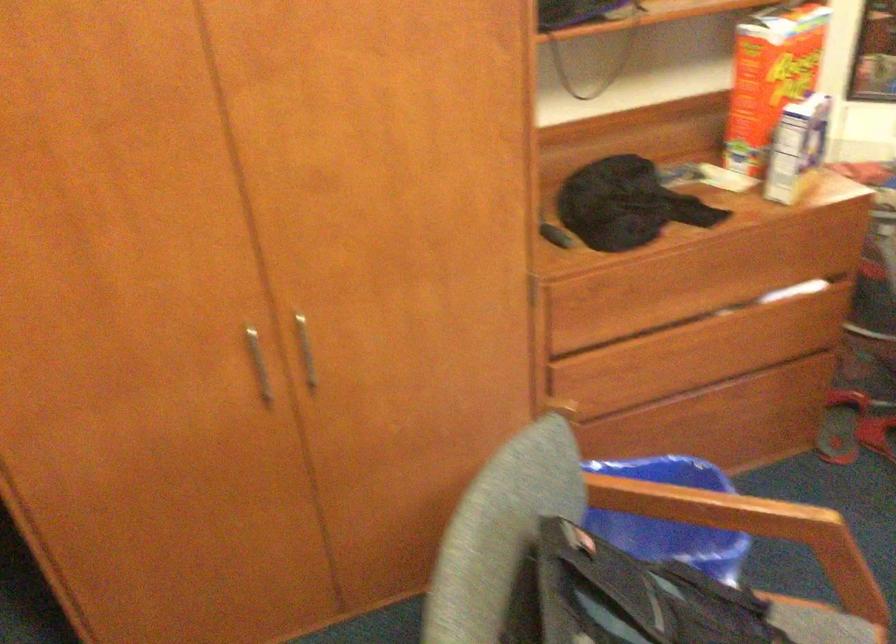
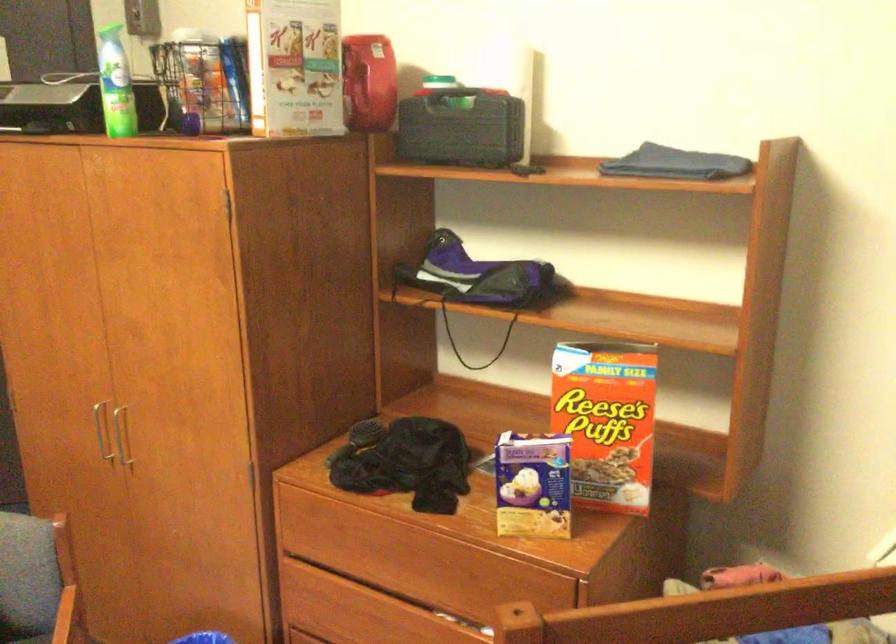
The point at (812, 67) is marked in the first image. Where is the corresponding point in the second image?

(606, 420)